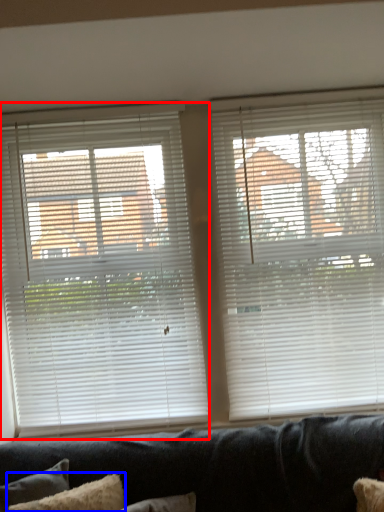
Question: Which of the following is the farthest to the observer, window blind (highlighted by a red box) or pillow (highlighted by a blue box)?

Choices:
 (A) window blind
 (B) pillow

Answer: (A)